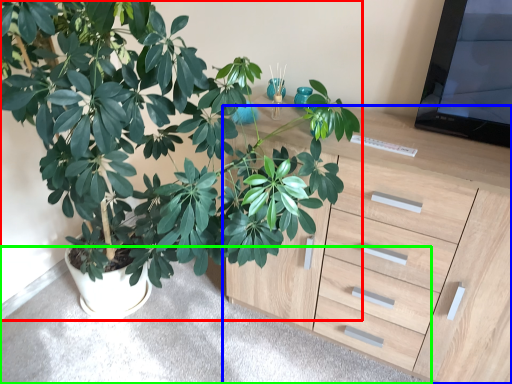
Question: Which object is positioned farthest from houseplant (highlighted by a red box)? Select from chest of drawers (highlighted by a blue box) and gray (highlighted by a green box).

Choices:
 (A) chest of drawers
 (B) gray

Answer: (B)